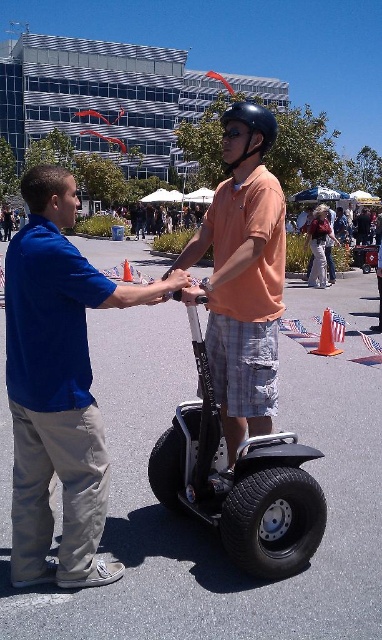
Which is more to the left, silver metallic scooter at center or orange traffic cone at center?

orange traffic cone at center is more to the left.

Is silver metallic scooter at center closer to the viewer compared to orange traffic cone at center?

Yes, it is.

Is point (299, 531) less distant than point (132, 276)?

Yes, point (299, 531) is in front of point (132, 276).

The image size is (382, 640). Identify the location of silver metallic scooter at center. (239, 483).

The height and width of the screenshot is (640, 382). What do you see at coordinates (239, 483) in the screenshot? I see `silver metallic scooter at center` at bounding box center [239, 483].

Where is `silver metallic scooter at center`? silver metallic scooter at center is located at coordinates (239, 483).

Does black matte helmet at center appear on the right side of orange traffic cone at center?

Yes, black matte helmet at center is to the right of orange traffic cone at center.

Is black matte helmet at center further to the viewer compared to orange traffic cone at center?

No, it is not.

Who is more forward, (268, 134) or (123, 262)?

Point (268, 134) is more forward.

Locate an element on the screen. The image size is (382, 640). black matte helmet at center is located at coordinates (250, 129).